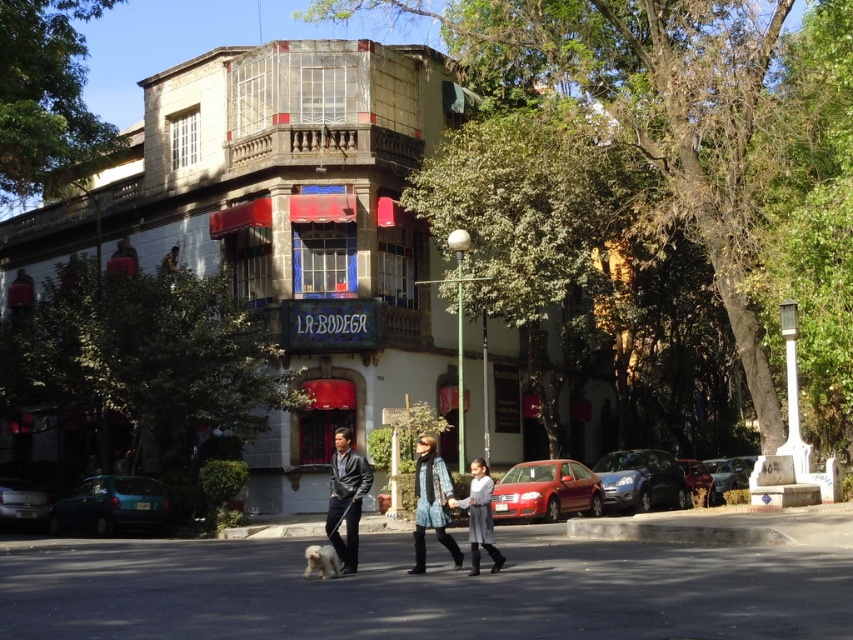
Measure the distance from leather jacket at center to metallic silver car at lower right.

They are 43.13 feet apart.

Locate an element on the screen. leather jacket at center is located at coordinates (346, 497).

Which of these two, silver metallic car at lower left or metallic silver car at lower right, stands shorter?

metallic silver car at lower right is shorter.

Is silver metallic car at lower left above metallic silver car at lower right?

Yes.

The height and width of the screenshot is (640, 853). What do you see at coordinates (22, 502) in the screenshot? I see `silver metallic car at lower left` at bounding box center [22, 502].

I want to click on silver metallic car at lower left, so click(x=22, y=502).

Is silver metallic car at lower left positioned before white fur dog at lower center?

No, it is behind white fur dog at lower center.

Is silver metallic car at lower left bigger than white fur dog at lower center?

Yes, silver metallic car at lower left is bigger than white fur dog at lower center.

At what (x,y) coordinates should I click in order to perform the action: click on silver metallic car at lower left. Please return your answer as a coordinate pair (x, y). This screenshot has height=640, width=853. Looking at the image, I should click on (22, 502).